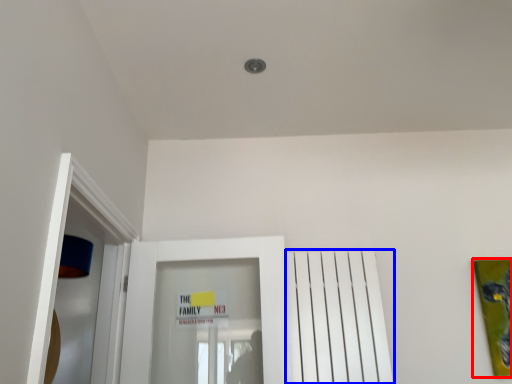
Question: Which object appears farthest to the camera in this image, picture frame (highlighted by a red box) or radiator (highlighted by a blue box)?

Choices:
 (A) picture frame
 (B) radiator

Answer: (A)